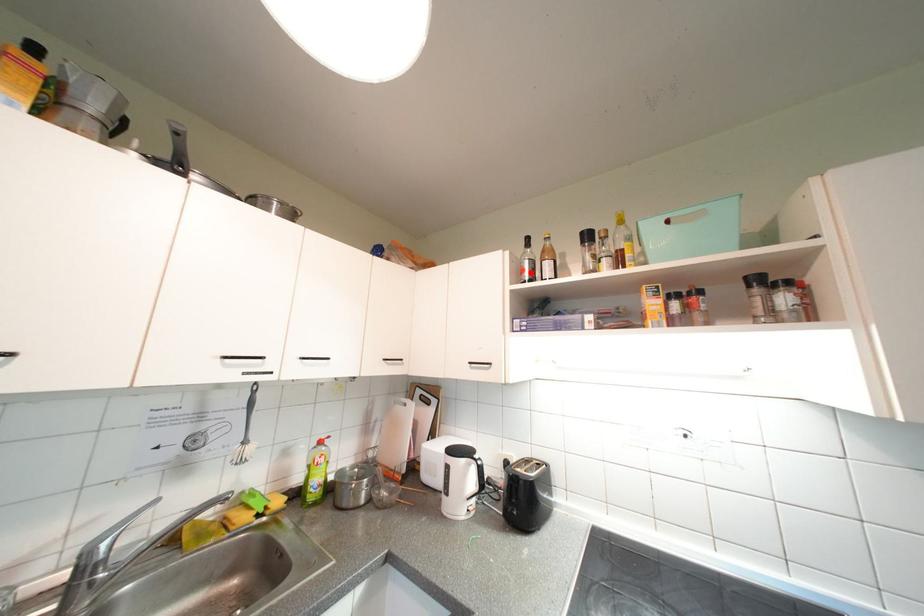
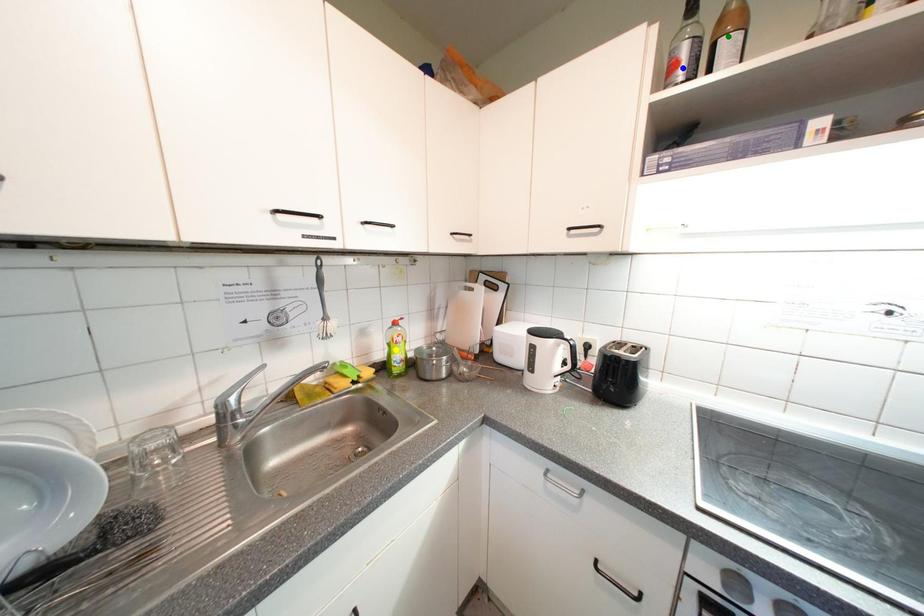
Question: I am providing you with two images of the same scene from different viewpoints. A red point is marked on the first image. You are given multiple points on the second image. Which point in image 2 is actually the same real-world point as the red point in image 1?

Choices:
 (A) blue point
 (B) yellow point
 (C) green point

Answer: (A)